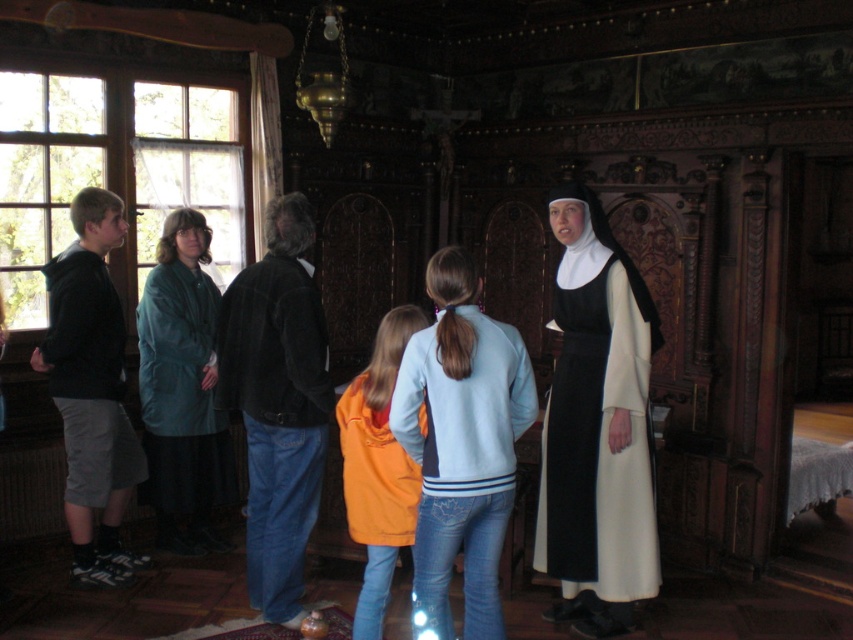
Question: Among these objects, which one is farthest from the camera?

Choices:
 (A) dark gray shorts at left
 (B) orange fleece jacket at center
 (C) matte black hoodie at left

Answer: (A)

Question: Which object is farther from the camera taking this photo?

Choices:
 (A) orange fleece jacket at center
 (B) teal fabric coat at center
 (C) matte black hoodie at left
 (D) white matte nun's habit at center

Answer: (B)

Question: Does matte black hoodie at left appear over white matte robe at center?

Choices:
 (A) no
 (B) yes

Answer: (B)

Question: Which is nearer to the dark gray shorts at left?

Choices:
 (A) matte black hoodie at left
 (B) teal fabric coat at center
 (C) white matte robe at center

Answer: (B)

Question: Does white matte nun's habit at center have a lesser width compared to teal fabric coat at center?

Choices:
 (A) yes
 (B) no

Answer: (B)

Question: Considering the relative positions of velvet black jacket at center and white matte robe at center in the image provided, where is velvet black jacket at center located with respect to white matte robe at center?

Choices:
 (A) below
 (B) above

Answer: (B)